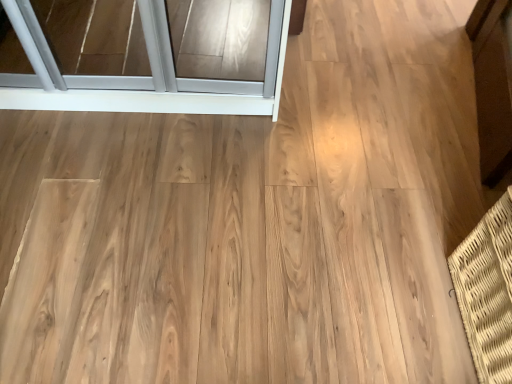
Consider the image. In order to face natural wood floor at center, should I rotate leftwards or rightwards?

To align with it, rotate left about 0.831°.

You are a GUI agent. You are given a task and a screenshot of the screen. Output one action in this format:
    pyautogui.click(x=<x>, y=<y>)
    Task: Click on the natural wood floor at center
    
    Given the screenshot: What is the action you would take?
    pyautogui.click(x=209, y=261)

This screenshot has width=512, height=384. Describe the element at coordinates (209, 261) in the screenshot. I see `natural wood floor at center` at that location.

Locate an element on the screen. This screenshot has width=512, height=384. natural wood floor at center is located at coordinates (209, 261).